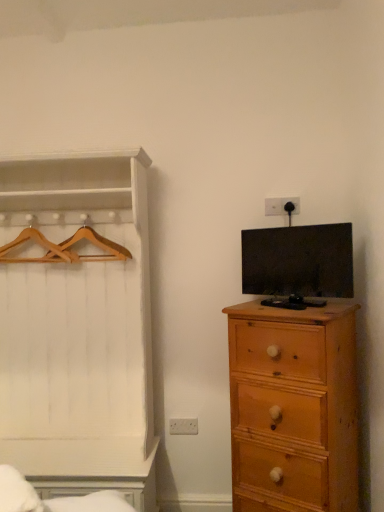
Question: Is wooden hanger at left, which is counted as the 2th hanger, starting from the right, closer to camera compared to wooden hangers at left, placed as the 2th hanger when sorted from left to right?

Choices:
 (A) no
 (B) yes

Answer: (A)

Question: Is wooden hanger at left, which is counted as the 2th hanger, starting from the right, facing away from wooden hangers at left, which appears as the 1th hanger when viewed from the right?

Choices:
 (A) yes
 (B) no

Answer: (B)

Question: From a real-world perspective, is wooden hanger at left, which is counted as the 2th hanger, starting from the right, on wooden hangers at left, placed as the 2th hanger when sorted from left to right?

Choices:
 (A) yes
 (B) no

Answer: (B)

Question: Considering the relative positions of wooden hanger at left, which appears as the first hanger when viewed from the left, and wooden hangers at left, placed as the 2th hanger when sorted from left to right, in the image provided, is wooden hanger at left, which appears as the first hanger when viewed from the left, to the left of wooden hangers at left, placed as the 2th hanger when sorted from left to right, from the viewer's perspective?

Choices:
 (A) no
 (B) yes

Answer: (B)

Question: Does wooden hanger at left, which appears as the first hanger when viewed from the left, have a larger size compared to wooden hangers at left, placed as the 2th hanger when sorted from left to right?

Choices:
 (A) no
 (B) yes

Answer: (A)

Question: Looking at their shapes, would you say wooden hangers at left, which appears as the 1th hanger when viewed from the right, is wider or thinner than matte black tv at right?

Choices:
 (A) thin
 (B) wide

Answer: (B)

Question: From the image's perspective, is wooden hangers at left, which appears as the 1th hanger when viewed from the right, located above or below matte black tv at right?

Choices:
 (A) below
 (B) above

Answer: (B)

Question: Based on their positions, is wooden hangers at left, placed as the 2th hanger when sorted from left to right, located to the left or right of matte black tv at right?

Choices:
 (A) right
 (B) left

Answer: (B)

Question: Is wooden hangers at left, which appears as the 1th hanger when viewed from the right, taller or shorter than matte black tv at right?

Choices:
 (A) short
 (B) tall

Answer: (A)

Question: Do you think white wood dresser at left is within wooden hanger at left, which appears as the first hanger when viewed from the left, or outside of it?

Choices:
 (A) inside
 (B) outside

Answer: (B)

Question: From a real-world perspective, is white wood dresser at left above or below wooden hanger at left, which is counted as the 2th hanger, starting from the right?

Choices:
 (A) below
 (B) above

Answer: (A)

Question: Does point (97, 389) appear closer or farther from the camera than point (3, 251)?

Choices:
 (A) farther
 (B) closer

Answer: (B)

Question: Considering the positions of white wood dresser at left and wooden hanger at left, which is counted as the 2th hanger, starting from the right, in the image, is white wood dresser at left wider or thinner than wooden hanger at left, which is counted as the 2th hanger, starting from the right,?

Choices:
 (A) thin
 (B) wide

Answer: (B)

Question: From a real-world perspective, is matte black tv at right physically located above or below white wood dresser at left?

Choices:
 (A) above
 (B) below

Answer: (A)

Question: Based on their positions, is matte black tv at right located to the left or right of white wood dresser at left?

Choices:
 (A) left
 (B) right

Answer: (B)